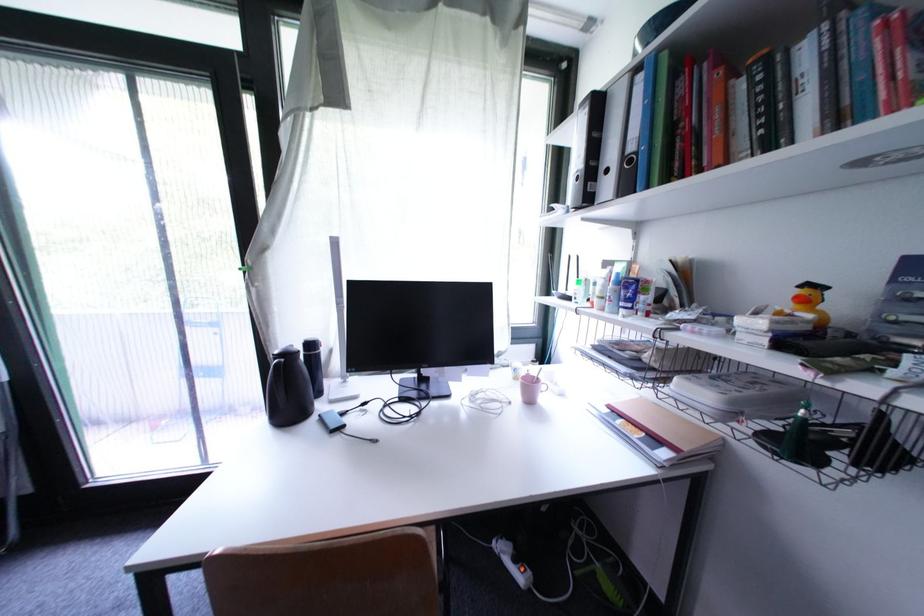
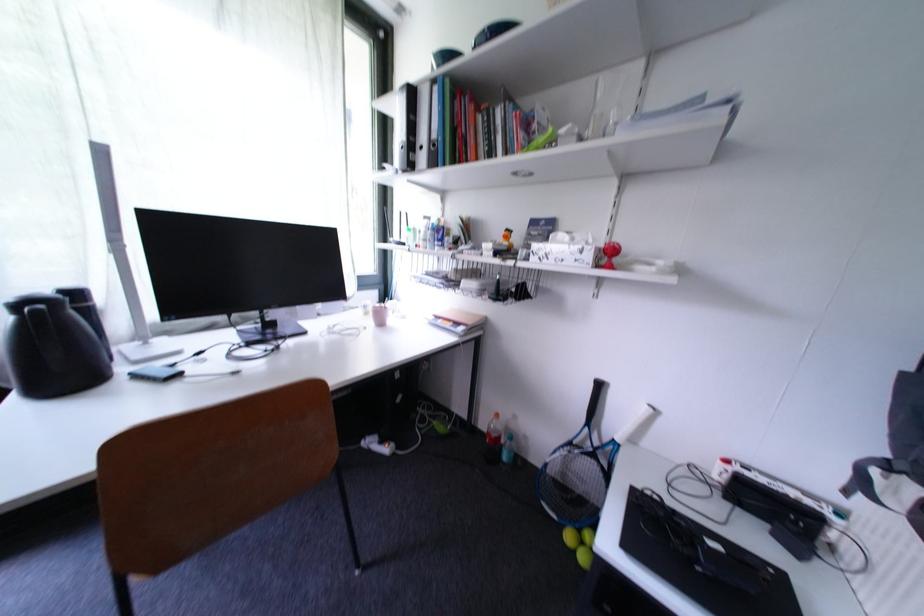
Locate, in the second image, the point that corresponds to (524,381) in the first image.

(373, 315)